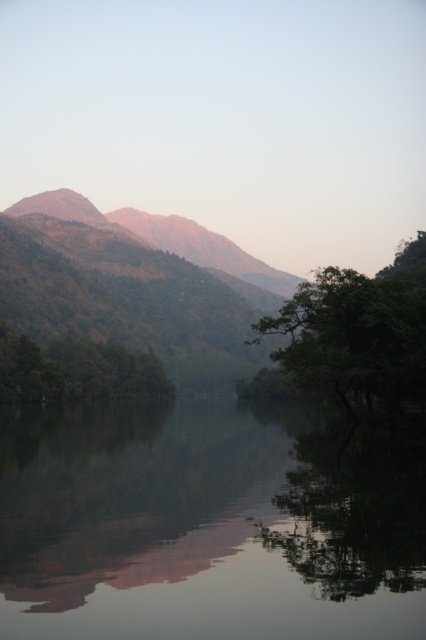
Question: Can you confirm if smooth reflective water at center is bigger than green leafy tree at right?

Choices:
 (A) yes
 (B) no

Answer: (B)

Question: Can you confirm if smooth reflective water at center is smaller than green leafy tree at right?

Choices:
 (A) yes
 (B) no

Answer: (A)

Question: Which object is closer to the camera taking this photo?

Choices:
 (A) green leafy tree at right
 (B) green matte tree at left
 (C) rustic brown mountain at upper left

Answer: (A)

Question: Which of the following is the closest to the observer?

Choices:
 (A) (77, 193)
 (B) (279, 499)
 (C) (143, 364)

Answer: (B)

Question: Which object is the closest to the green leafy tree at right?

Choices:
 (A) rustic brown mountain at upper left
 (B) green matte tree at left

Answer: (B)

Question: Is smooth reflective water at center bigger than rustic brown mountain at upper left?

Choices:
 (A) no
 (B) yes

Answer: (A)